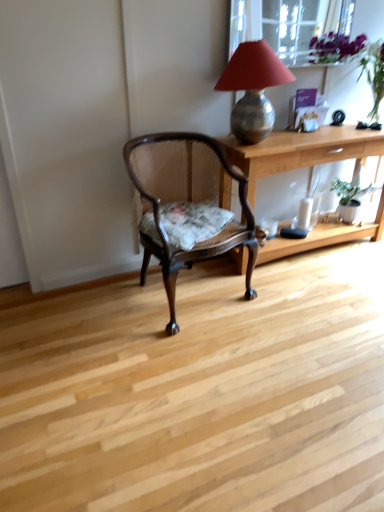
Locate an element on the screen. The height and width of the screenshot is (512, 384). free space above light wood desk at center (from a real-world perspective) is located at coordinates (323, 133).